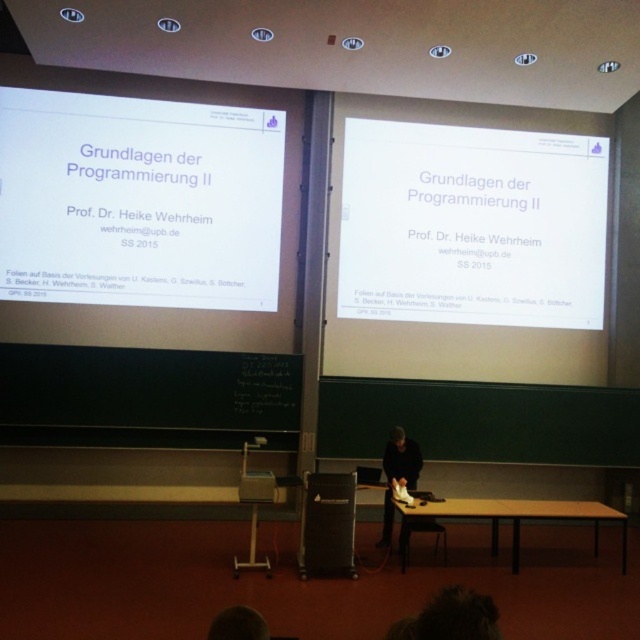
Question: Can you confirm if white matte projector screen at upper left is positioned above dark gray fabric jacket at center?

Choices:
 (A) yes
 (B) no

Answer: (A)

Question: Which point appears farthest from the camera in this image?

Choices:
 (A) (221, 166)
 (B) (388, 532)
 (C) (365, 204)

Answer: (C)

Question: Observing the image, what is the correct spatial positioning of white matte projector screen at upper left in reference to dark gray fabric jacket at center?

Choices:
 (A) right
 (B) left

Answer: (B)

Question: Which of the following is the closest to the observer?

Choices:
 (A) white matte projector screen at upper center
 (B) white matte projector screen at upper left
 (C) dark gray fabric jacket at center

Answer: (C)

Question: Among these points, which one is nearest to the camera?

Choices:
 (A) (77, 224)
 (B) (586, 236)
 (C) (390, 436)

Answer: (C)

Question: Considering the relative positions of white matte projector screen at upper center and dark gray fabric jacket at center in the image provided, where is white matte projector screen at upper center located with respect to dark gray fabric jacket at center?

Choices:
 (A) left
 (B) right

Answer: (B)